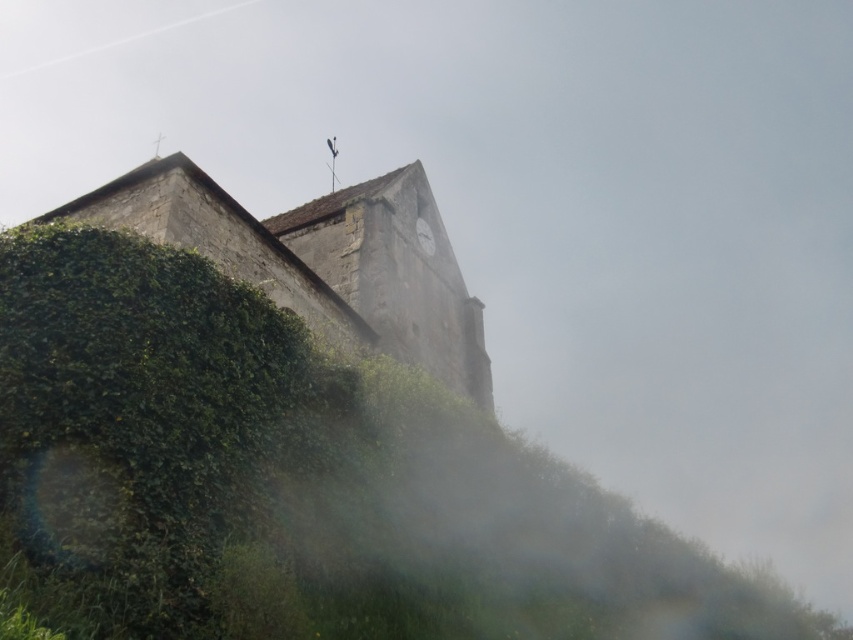
The width and height of the screenshot is (853, 640). Describe the element at coordinates (132, 420) in the screenshot. I see `green leafy hedge at left` at that location.

Locate an element on the screen. The height and width of the screenshot is (640, 853). green leafy hedge at left is located at coordinates (132, 420).

The width and height of the screenshot is (853, 640). Identify the location of green leafy hedge at left. (132, 420).